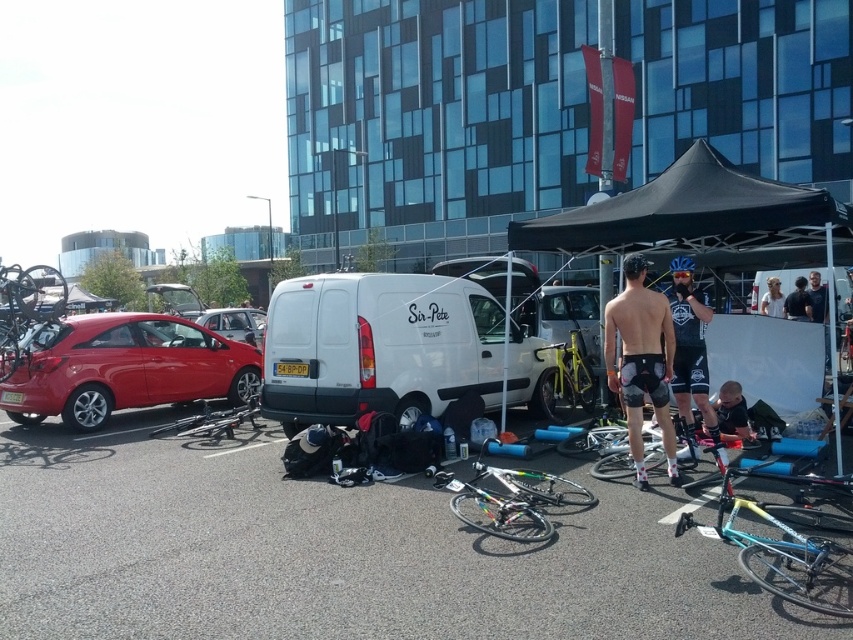
Question: Which is nearer to the shiny blue helmet at center?

Choices:
 (A) shiny metallic bicycle at center
 (B) shiny silver bicycle at center

Answer: (B)

Question: Does teal glossy bicycle at lower right have a lesser width compared to yellow metallic bicycle at center?

Choices:
 (A) no
 (B) yes

Answer: (A)

Question: Can you confirm if teal glossy bicycle at lower right is positioned below black matte cycling shorts at center?

Choices:
 (A) no
 (B) yes

Answer: (B)

Question: Which object is positioned farthest from the light brown hair at upper right?

Choices:
 (A) metallic silver hatchback at center-left
 (B) shiny black bicycle at left
 (C) white matte van at center
 (D) shiny black bicycle at center

Answer: (B)

Question: Which is farther from the shiny blue helmet at center?

Choices:
 (A) light brown hair at upper right
 (B) dark blue fabric shirt at lower right
 (C) white fabric shirt at upper right

Answer: (C)

Question: Is shiny silver bicycle at center wider than white fabric shirt at upper right?

Choices:
 (A) no
 (B) yes

Answer: (B)